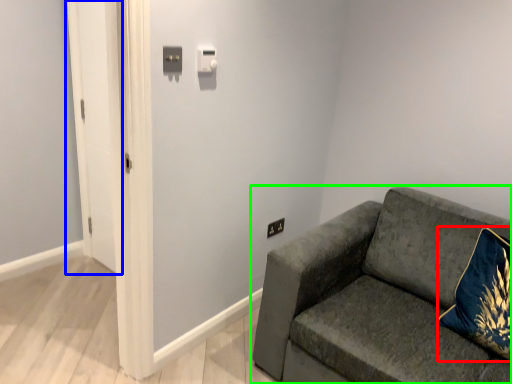
Question: Considering the real-world distances, which object is closest to throw pillow (highlighted by a red box)? glass door (highlighted by a blue box) or studio couch (highlighted by a green box).

Choices:
 (A) glass door
 (B) studio couch

Answer: (B)